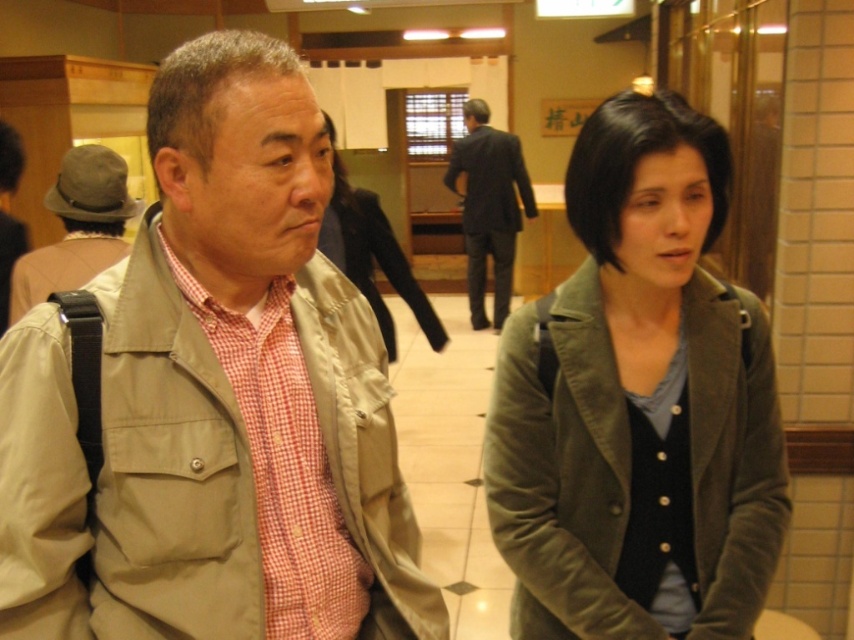
The image size is (854, 640). Describe the element at coordinates (215, 400) in the screenshot. I see `khaki fabric jacket at center` at that location.

Who is positioned more to the left, khaki fabric jacket at center or matte green jacket at center?

matte green jacket at center is more to the left.

Is point (37, 435) closer to viewer compared to point (390, 340)?

Yes.

Identify the location of khaki fabric jacket at center. (215, 400).

Identify the location of dark gray suit at center. (489, 205).

Is dark gray suit at center above dark gray wool jacket at center?

No, dark gray suit at center is not above dark gray wool jacket at center.

Is point (477, 284) farther from camera compared to point (500, 211)?

That is True.

Identify the location of dark gray suit at center. This screenshot has height=640, width=854. (489, 205).

Does khaki fabric jacket at center appear over matte olive green jacket at center?

Incorrect, khaki fabric jacket at center is not positioned above matte olive green jacket at center.

Between point (270, 308) and point (624, 124), which one is positioned behind?

The point (624, 124) is more distant.

Where is `khaki fabric jacket at center`? This screenshot has width=854, height=640. khaki fabric jacket at center is located at coordinates tap(215, 400).

At what (x,y) coordinates should I click in order to perform the action: click on khaki fabric jacket at center. Please return your answer as a coordinate pair (x, y). This screenshot has height=640, width=854. Looking at the image, I should click on (215, 400).